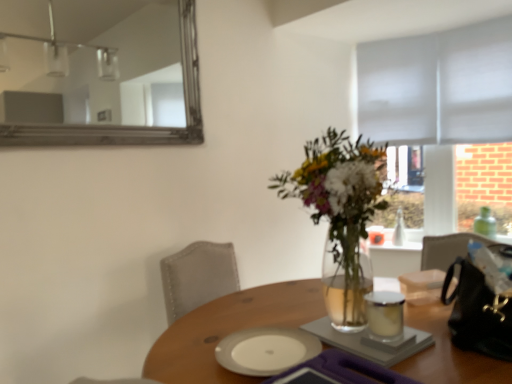
Question: Does wooden table at center come in front of silver-framed mirror at upper left?

Choices:
 (A) no
 (B) yes

Answer: (B)

Question: Does wooden table at center have a lesser height compared to silver-framed mirror at upper left?

Choices:
 (A) yes
 (B) no

Answer: (A)

Question: Can you confirm if wooden table at center is bigger than silver-framed mirror at upper left?

Choices:
 (A) no
 (B) yes

Answer: (B)

Question: Can you confirm if wooden table at center is positioned to the right of silver-framed mirror at upper left?

Choices:
 (A) no
 (B) yes

Answer: (B)

Question: From a real-world perspective, is wooden table at center below silver-framed mirror at upper left?

Choices:
 (A) yes
 (B) no

Answer: (A)

Question: Is wooden table at center beside silver-framed mirror at upper left?

Choices:
 (A) yes
 (B) no

Answer: (B)

Question: Could you tell me if wooden table at center is facing gray fabric blind at upper right?

Choices:
 (A) yes
 (B) no

Answer: (B)

Question: Is wooden table at center thinner than gray fabric blind at upper right?

Choices:
 (A) no
 (B) yes

Answer: (A)

Question: Is wooden table at center not inside gray fabric blind at upper right?

Choices:
 (A) yes
 (B) no

Answer: (A)

Question: From a real-world perspective, does wooden table at center stand above gray fabric blind at upper right?

Choices:
 (A) yes
 (B) no

Answer: (B)

Question: Is wooden table at center far from gray fabric blind at upper right?

Choices:
 (A) yes
 (B) no

Answer: (A)

Question: Does wooden table at center appear on the right side of gray fabric blind at upper right?

Choices:
 (A) no
 (B) yes

Answer: (A)

Question: Is gray fabric blind at upper right touching wooden table at center?

Choices:
 (A) yes
 (B) no

Answer: (B)